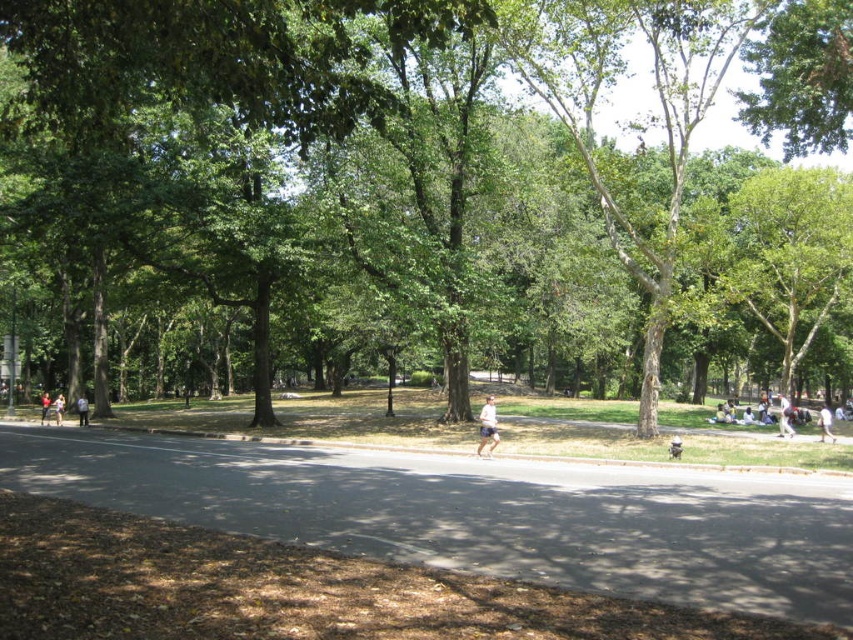
Question: Which point appears farthest from the camera in this image?

Choices:
 (A) (543, 300)
 (B) (730, 401)
 (C) (61, 413)

Answer: (A)

Question: Which of these objects is positioned closest to the light blue shorts at left?

Choices:
 (A) light brown textured shorts at center
 (B) asphalt road at center
 (C) light brown leather jacket at left
 (D) green leafy tree at center

Answer: (C)

Question: Can you confirm if light blue fabric shirt at right is bigger than light blue shorts at left?

Choices:
 (A) yes
 (B) no

Answer: (B)

Question: Does white cotton shirt at lower right have a larger size compared to light blue fabric shirt at right?

Choices:
 (A) yes
 (B) no

Answer: (A)

Question: Which of these objects is positioned farthest from the white cotton shirt at lower right?

Choices:
 (A) light brown leather jacket at center
 (B) light brown leather jacket at left
 (C) white cotton shirt at center
 (D) light blue shorts at left

Answer: (A)

Question: Is light blue fabric shirt at right further to the viewer compared to light blue shorts at left?

Choices:
 (A) no
 (B) yes

Answer: (A)